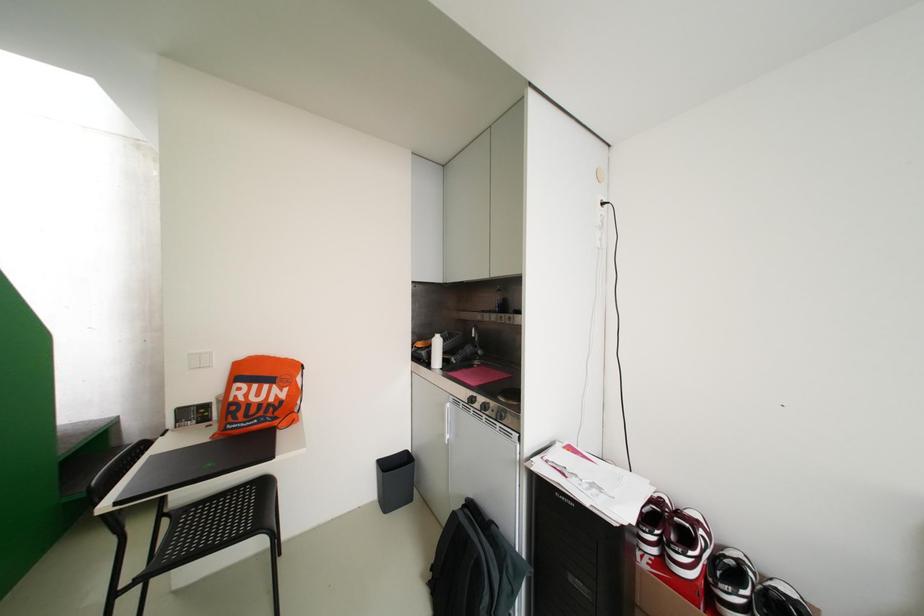
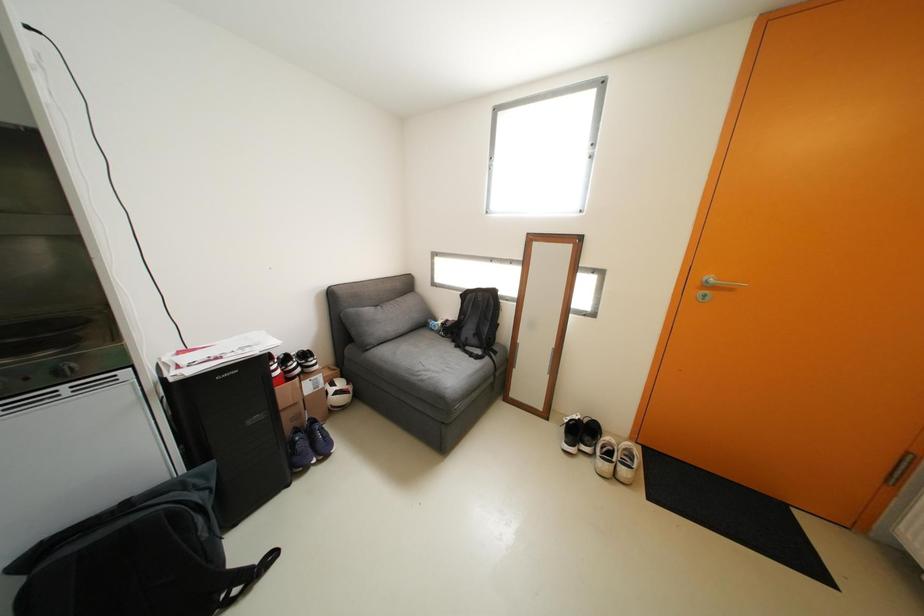
How did the camera likely rotate?

The rotation direction of the camera is right-down.